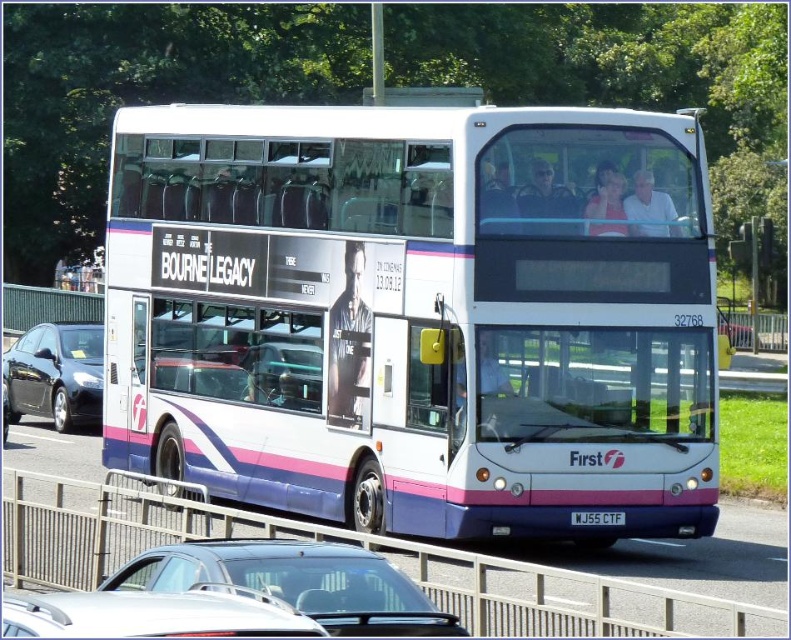
You are standing on the sidewalk and see the silver metallic car at center and the white plastic license plate at center. Which one is closer to the left side of the road?

The silver metallic car at center is to the left of the white plastic license plate at center, so the silver metallic car at center is closer to the left side of the road.

You are standing at the point of the silver metallic car at center. Which direction should you face to see the bus?

You should face north to see the bus.

You are a pedestrian standing in front of the white glossy bus at center and the white plastic license plate at center. Which object is higher up from the ground?

The white glossy bus at center is above the white plastic license plate at center, so the white glossy bus at center is higher up from the ground.